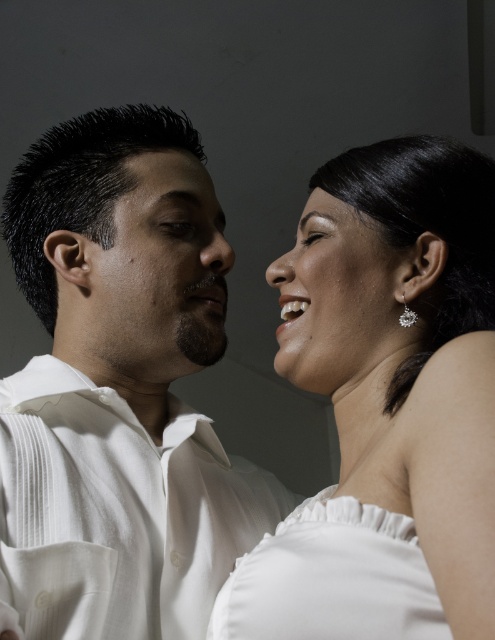
In the scene shown: Does satin white earring at upper right appear over clear crystal earring at upper right?

Correct, satin white earring at upper right is located above clear crystal earring at upper right.

Does satin white earring at upper right have a greater width compared to clear crystal earring at upper right?

Indeed, satin white earring at upper right has a greater width compared to clear crystal earring at upper right.

Where is `satin white earring at upper right`? satin white earring at upper right is located at coordinates (340, 300).

Does point (190, 348) come behind point (122, 352)?

No, it is not.

Does white pleated shirt at center lie behind smooth skin face at center?

No, it is not.

You are a GUI agent. You are given a task and a screenshot of the screen. Output one action in this format:
    pyautogui.click(x=<x>, y=<y>)
    Task: Click on the white pleated shirt at center
    The image size is (495, 640).
    Given the screenshot: What is the action you would take?
    pyautogui.click(x=131, y=356)

Does white satin dress at upper right have a greater width compared to clear crystal earring at upper right?

Yes.

Between white satin dress at upper right and clear crystal earring at upper right, which one is positioned higher?

clear crystal earring at upper right is above.

The image size is (495, 640). In order to click on white satin dress at upper right in this screenshot , I will do `click(387, 403)`.

The image size is (495, 640). What are the coordinates of `white satin dress at upper right` in the screenshot? It's located at (387, 403).